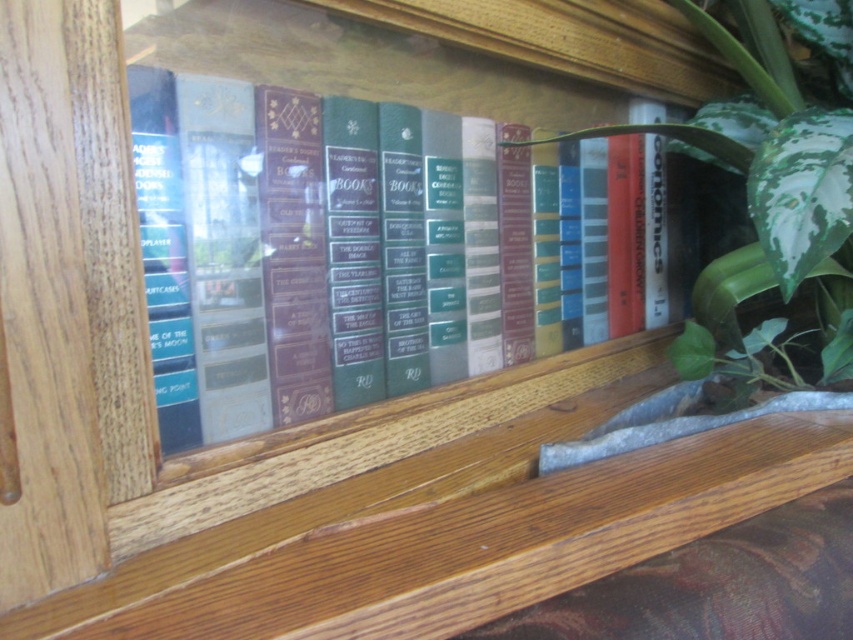
You are a photographer who wants to take a closeup shot of the hardcover books at center. Your camera has a minimum focusing distance of 45 centimeters. Can you take the photo without moving the camera closer?

The distance between the hardcover books at center and the camera is 44.37 centimeters, which is less than the camera minimum focusing distance of 45 centimeters. Therefore, you cannot take the photo without moving the camera closer.

You are organizing a small space and need to know if the hardcover books at center can fit in a spot currently occupied by the green leafy plant at right. Based on their sizes, can the books fit there?

The hardcover books at center occupies less space than green leafy plant at right, so yes, the books can fit in the spot currently occupied by the green leafy plant at right since they take up less space.

Consider the image. You are looking at the wooden bookshelf and notice two points marked on it. The first point is at coordinate (245, 406) and the second is at (685, 342). Which point is closer to you?

Point (245, 406) is closer to the camera than point (685, 342).